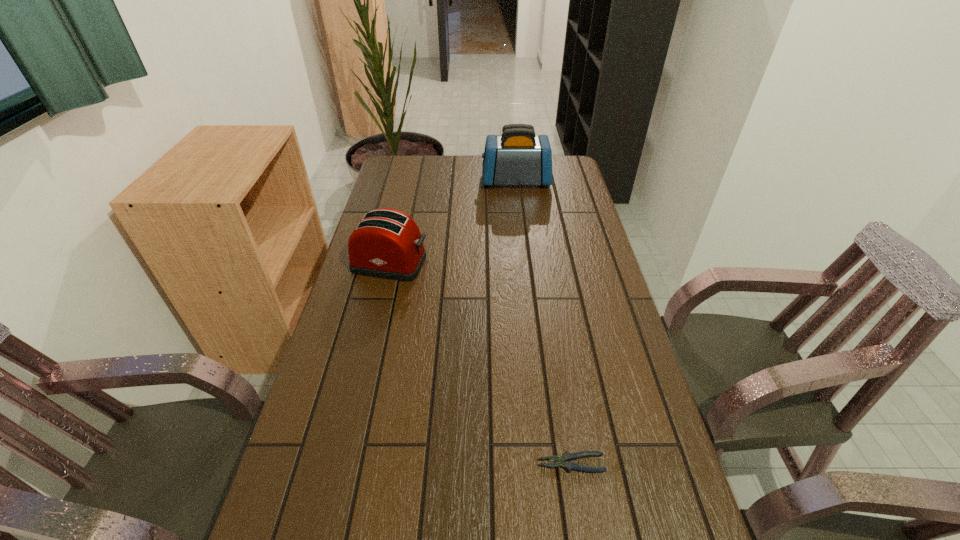
Where is `free location located 0.090m at the gripping part of the nearest object`? free location located 0.090m at the gripping part of the nearest object is located at coordinates (495, 463).

Locate an element on the screen. The width and height of the screenshot is (960, 540). blank space located 0.320m at the gripping part of the nearest object is located at coordinates (386, 463).

You are a GUI agent. You are given a task and a screenshot of the screen. Output one action in this format:
    pyautogui.click(x=<x>, y=<y>)
    Task: Click on the vacant space positioned at the gripping part of the nearest object
    Image resolution: width=960 pixels, height=540 pixels.
    Given the screenshot: What is the action you would take?
    pyautogui.click(x=495, y=463)

Identify the location of object that is at the far edge. click(517, 157).

The width and height of the screenshot is (960, 540). I want to click on object that is at the left edge, so click(x=387, y=243).

Identify the location of toaster situated at the right edge. (517, 157).

The height and width of the screenshot is (540, 960). Find the location of `pliers that is at the right edge`. pliers that is at the right edge is located at coordinates (564, 461).

Where is `object located at the far right corner`? object located at the far right corner is located at coordinates (517, 157).

You are a GUI agent. You are given a task and a screenshot of the screen. Output one action in this format:
    pyautogui.click(x=<x>, y=<y>)
    Task: Click on the vacant point at the far edge
    The image size is (960, 540).
    Given the screenshot: What is the action you would take?
    pyautogui.click(x=479, y=157)

I want to click on free space at the left edge, so click(389, 190).